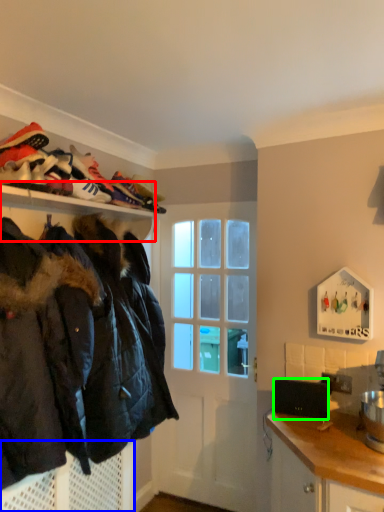
Question: Estimate the real-world distances between objects in this image. Which object is closer to shelf (highlighted by a red box), cabinetry (highlighted by a blue box) or laptop (highlighted by a green box)?

Choices:
 (A) cabinetry
 (B) laptop

Answer: (A)